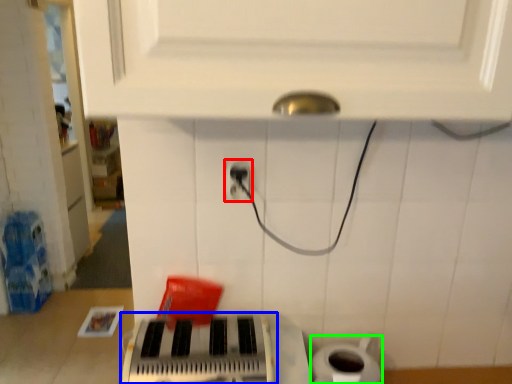
Question: Estimate the real-world distances between objects in this image. Which object is closer to power plugs and sockets (highlighted by a red box), musical keyboard (highlighted by a blue box) or toilet paper (highlighted by a green box)?

Choices:
 (A) musical keyboard
 (B) toilet paper

Answer: (A)